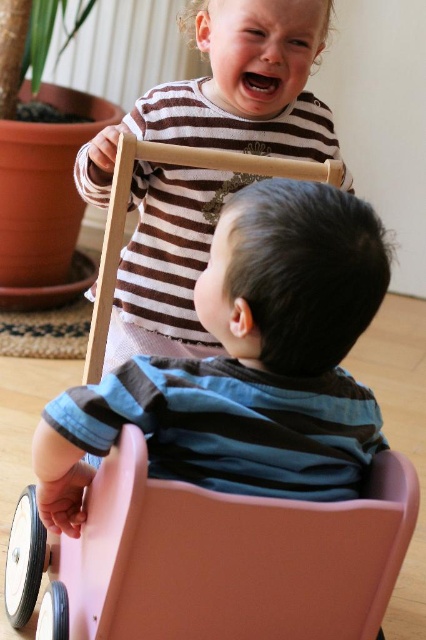
Measure the distance between matte pink plastic chair at center and camera.

80.76 centimeters

Looking at this image, which is above, matte pink plastic chair at center or striped cotton shirt at upper center?

Positioned higher is striped cotton shirt at upper center.

The image size is (426, 640). What are the coordinates of `matte pink plastic chair at center` in the screenshot? It's located at (245, 364).